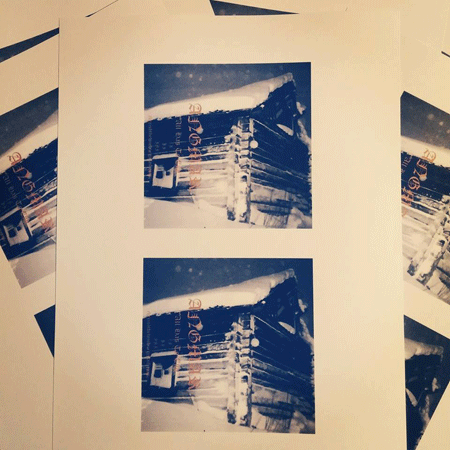
Where is `window`? This screenshot has width=450, height=450. window is located at coordinates (167, 375).